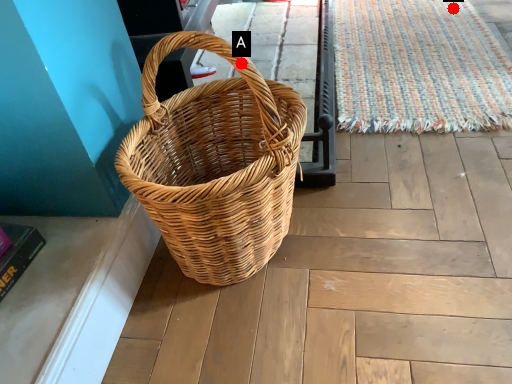
Question: Two points are circled on the image, labeled by A and B beside each circle. Which of the following is the farthest from the observer?

Choices:
 (A) A is further
 (B) B is further

Answer: (B)